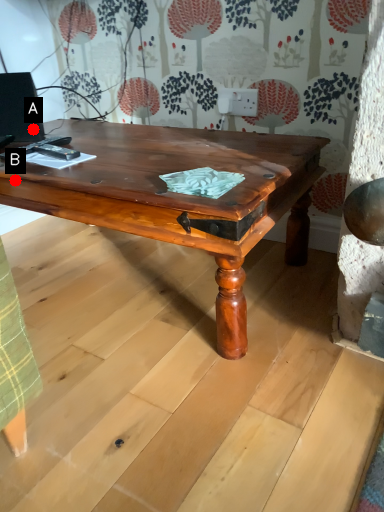
Question: Two points are circled on the image, labeled by A and B beside each circle. Which point appears closest to the camera in this image?

Choices:
 (A) A is closer
 (B) B is closer

Answer: (B)